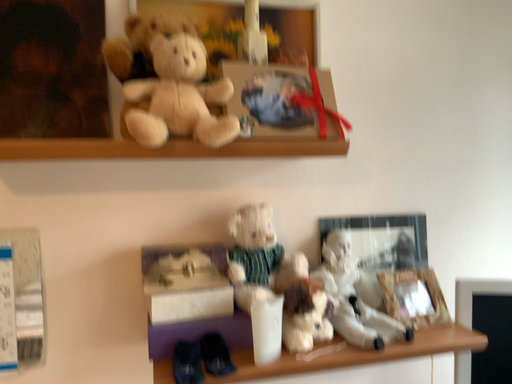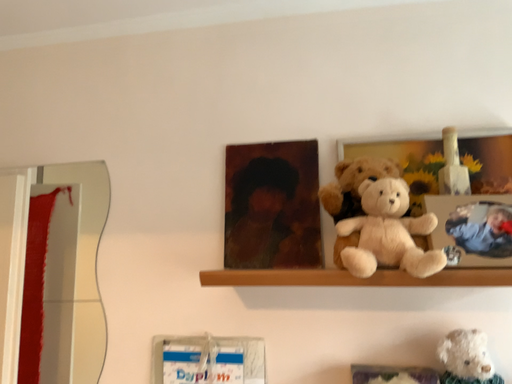
Question: Which way did the camera rotate in the video?

Choices:
 (A) rotated upward
 (B) rotated downward

Answer: (A)